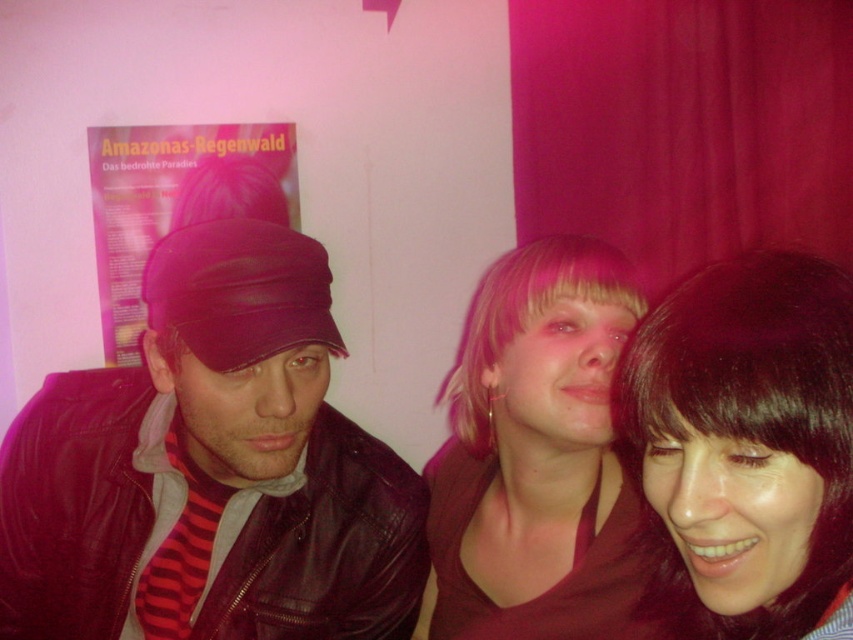
Question: Does matte pink poster at upper left appear on the right side of blondehair at center?

Choices:
 (A) yes
 (B) no

Answer: (B)

Question: Which of the following is the closest to the observer?

Choices:
 (A) click(x=751, y=410)
 (B) click(x=602, y=548)
 (C) click(x=492, y=321)
 (D) click(x=241, y=580)

Answer: (A)

Question: Based on their relative distances, which object is farther from the leather jacket at left?

Choices:
 (A) dark brown silky hair at lower right
 (B) blondehair at center
 (C) matte pink poster at upper left

Answer: (C)

Question: Can you confirm if pink hair at center is smaller than matte pink poster at upper left?

Choices:
 (A) no
 (B) yes

Answer: (A)

Question: Can you confirm if leather jacket at left is positioned to the right of blondehair at center?

Choices:
 (A) yes
 (B) no

Answer: (B)

Question: Which point is closer to the camera taking this photo?

Choices:
 (A) (283, 200)
 (B) (669, 435)
 (C) (252, 564)
 (D) (619, 321)

Answer: (B)